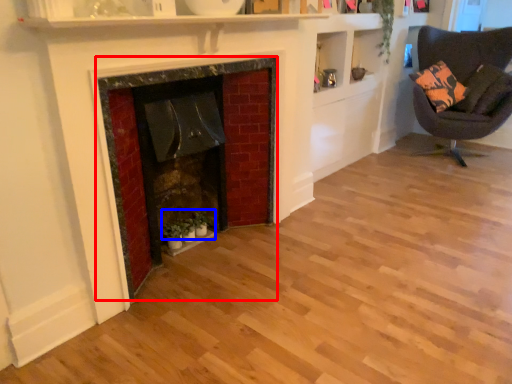
Question: Which object is closer to the camera taking this photo, fireplace (highlighted by a red box) or plant (highlighted by a blue box)?

Choices:
 (A) fireplace
 (B) plant

Answer: (A)